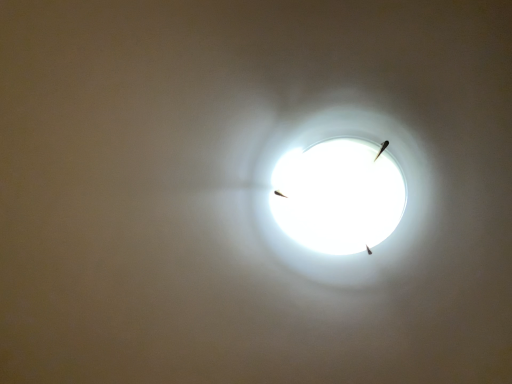
What is the approximate width of white glossy lamp at center?

It is 9.58 inches.

The width and height of the screenshot is (512, 384). Find the location of `white glossy lamp at center`. white glossy lamp at center is located at coordinates (343, 195).

Describe the element at coordinates (343, 195) in the screenshot. I see `white glossy lamp at center` at that location.

The width and height of the screenshot is (512, 384). In order to click on white glossy lamp at center in this screenshot , I will do point(343,195).